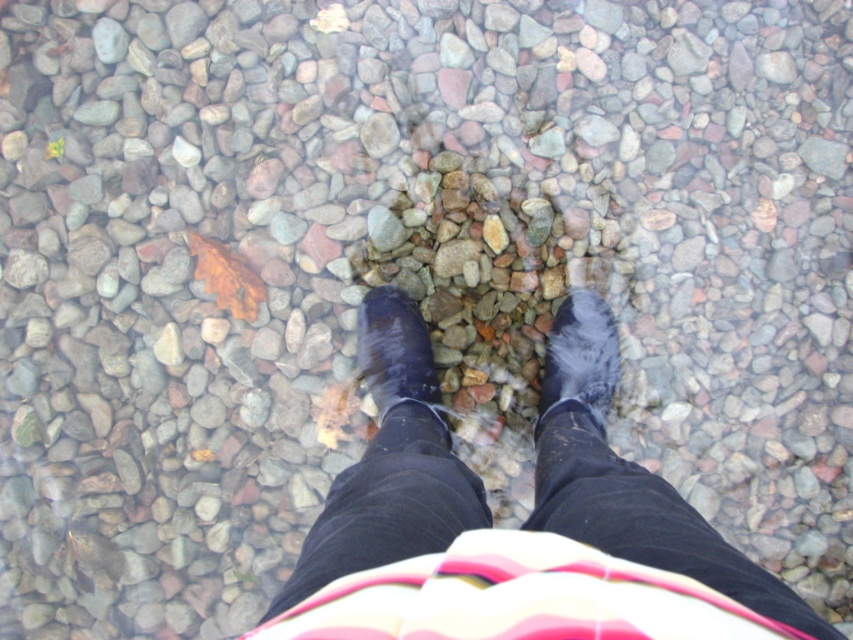
Describe the element at coordinates (579, 360) in the screenshot. I see `rubber/matte shoe at center` at that location.

Does rubber/matte shoe at center have a lesser width compared to shiny black boot at center?

In fact, rubber/matte shoe at center might be wider than shiny black boot at center.

Who is more forward, (548, 403) or (392, 292)?

Point (548, 403)

Where is `rubber/matte shoe at center`? Image resolution: width=853 pixels, height=640 pixels. rubber/matte shoe at center is located at coordinates (579, 360).

Who is shorter, wet rubber boots at center or rubber/matte shoe at center?

Standing shorter between the two is rubber/matte shoe at center.

Is wet rubber boots at center in front of rubber/matte shoe at center?

Yes.

Locate an element on the screen. The width and height of the screenshot is (853, 640). wet rubber boots at center is located at coordinates (524, 522).

Does wet rubber boots at center have a smaller size compared to shiny black boot at center?

Actually, wet rubber boots at center might be larger than shiny black boot at center.

Can you confirm if wet rubber boots at center is shorter than shiny black boot at center?

No, wet rubber boots at center is not shorter than shiny black boot at center.

You are a GUI agent. You are given a task and a screenshot of the screen. Output one action in this format:
    pyautogui.click(x=<x>, y=<y>)
    Task: Click on the wet rubber boots at center
    
    Given the screenshot: What is the action you would take?
    coord(524,522)